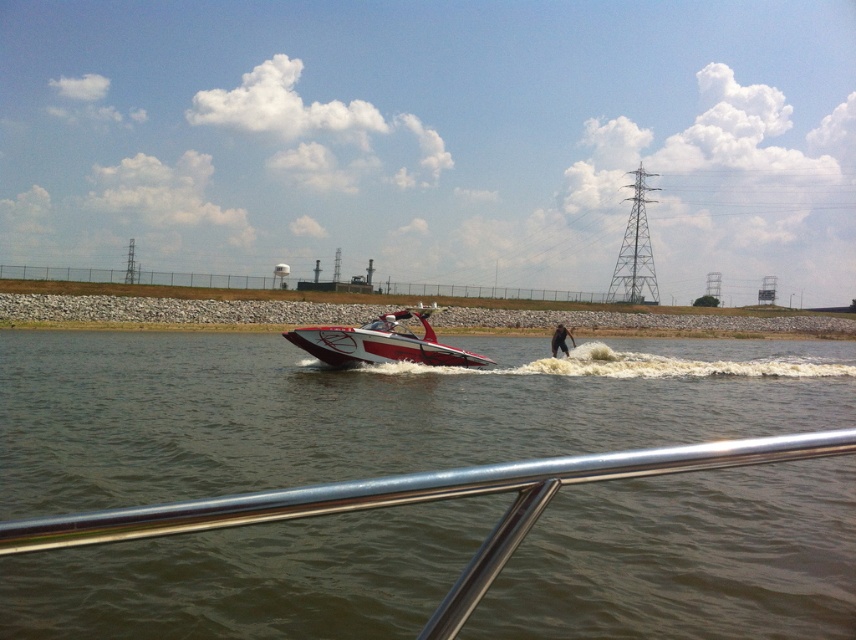
Does point (443, 355) lie behind point (556, 337)?

No, it is in front of (556, 337).

Is point (377, 320) positioned before point (572, 346)?

Yes.

Locate an element on the screen. This screenshot has width=856, height=640. shiny red and white speedboat at center is located at coordinates (383, 342).

Find the location of a particular element. The image size is (856, 640). shiny red and white speedboat at center is located at coordinates (383, 342).

Between clear water at center and shiny red and white speedboat at center, which one is positioned higher?

Positioned higher is shiny red and white speedboat at center.

Does clear water at center have a lesser height compared to shiny red and white speedboat at center?

Yes, clear water at center is shorter than shiny red and white speedboat at center.

Locate an element on the screen. The width and height of the screenshot is (856, 640). clear water at center is located at coordinates (369, 410).

Where is `clear water at center`? The height and width of the screenshot is (640, 856). clear water at center is located at coordinates (369, 410).

Measure the distance from clear water at center to black fabric pants at lower center.

clear water at center and black fabric pants at lower center are 49.17 feet apart.

Between point (186, 376) and point (574, 342), which one is positioned behind?

The point (574, 342) is more distant.

Locate an element on the screen. Image resolution: width=856 pixels, height=640 pixels. clear water at center is located at coordinates (369, 410).